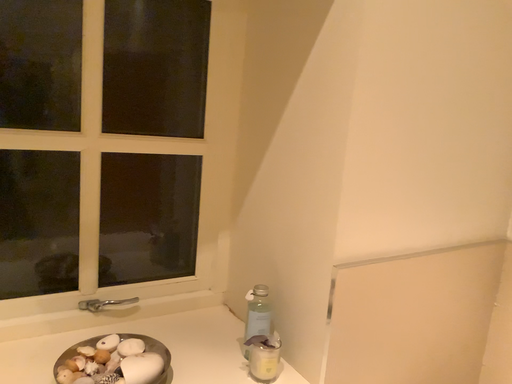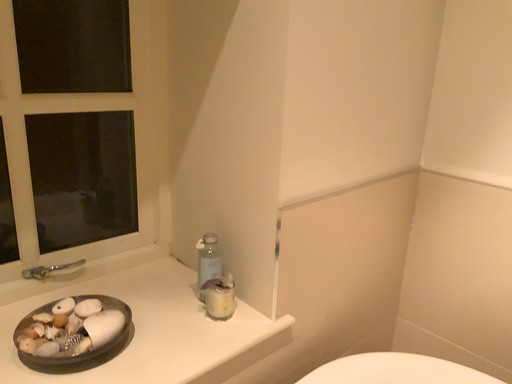
Question: How did the camera likely rotate when shooting the video?

Choices:
 (A) rotated left
 (B) rotated right

Answer: (B)